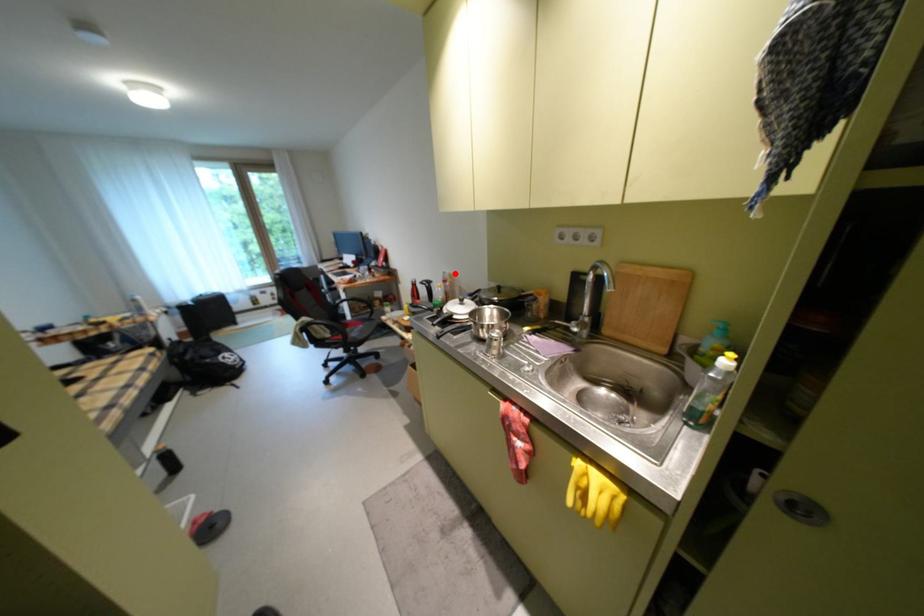
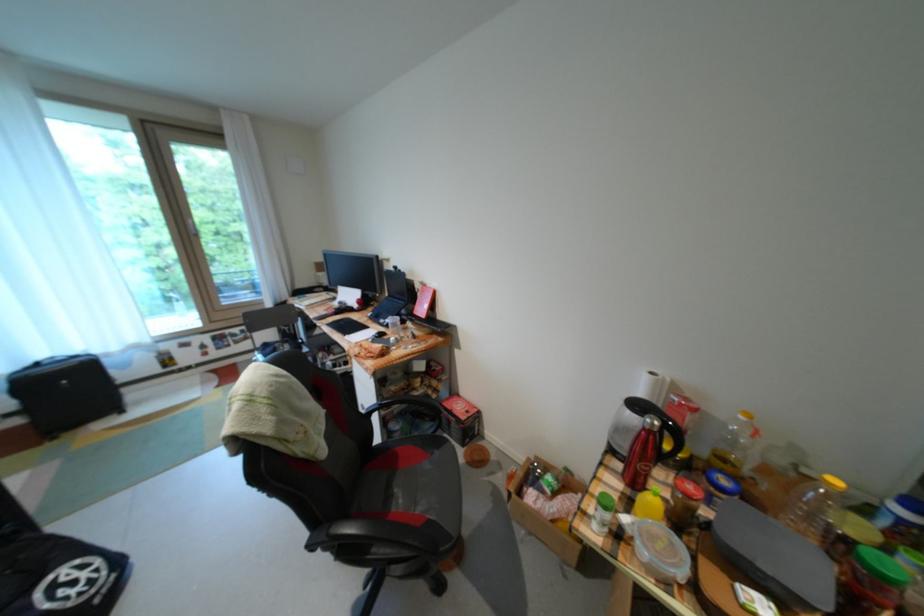
Find the pixel in the second image that matches the highlighted location in the first image.

(662, 374)